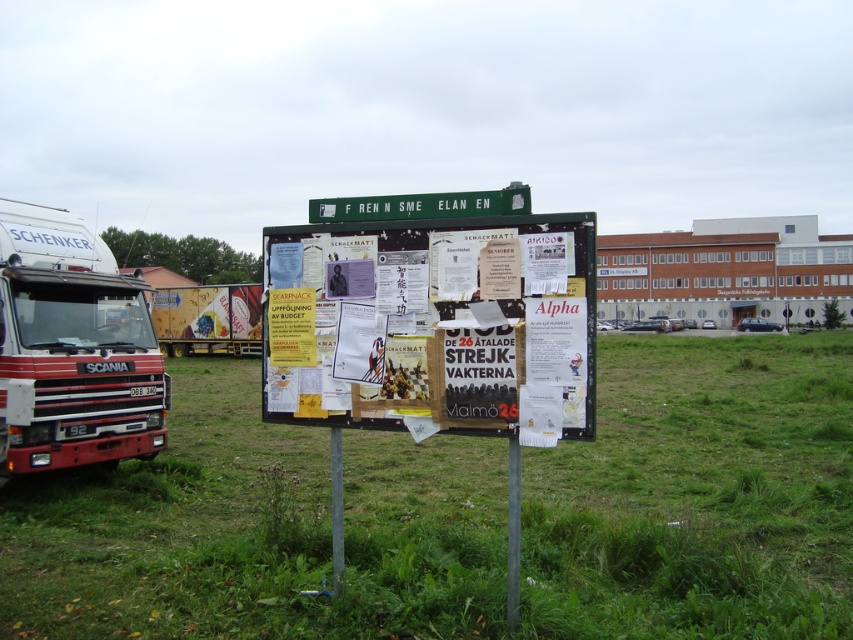
Question: Does green grassy at left have a greater width compared to red matte truck at left?

Choices:
 (A) no
 (B) yes

Answer: (B)

Question: Which object is closer to the camera taking this photo?

Choices:
 (A) metallic silver truck at left
 (B) green grassy at left
 (C) paper posters at center
 (D) red matte truck at left

Answer: (C)

Question: Does green grassy at left appear on the right side of metallic silver truck at left?

Choices:
 (A) no
 (B) yes

Answer: (B)

Question: Is green grassy at left thinner than paper posters at center?

Choices:
 (A) no
 (B) yes

Answer: (A)

Question: Among these objects, which one is nearest to the camera?

Choices:
 (A) metallic silver truck at left
 (B) red matte truck at left
 (C) green grassy at left

Answer: (C)

Question: Estimate the real-world distances between objects in this image. Which object is farther from the red matte truck at left?

Choices:
 (A) green grassy at left
 (B) metallic silver truck at left

Answer: (B)